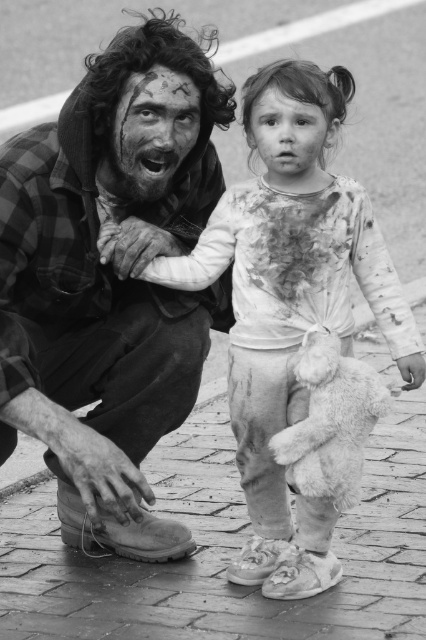
Question: From the image, what is the correct spatial relationship of dirty skin face at center in relation to dirty white face at center?

Choices:
 (A) above
 (B) below

Answer: (A)

Question: Is dirty plaid shirt at left further to camera compared to dirty skin face at center?

Choices:
 (A) yes
 (B) no

Answer: (B)

Question: Among these objects, which one is farthest from the camera?

Choices:
 (A) dirty white face at center
 (B) dirty plaid shirt at left
 (C) white cotton shirt at center
 (D) dirty skin face at center

Answer: (D)

Question: Among these points, which one is farthest from the camera?

Choices:
 (A) (x=264, y=282)
 (B) (x=189, y=106)
 (C) (x=255, y=113)

Answer: (B)

Question: Is the position of dirty skin face at center more distant than that of dirty white face at center?

Choices:
 (A) yes
 (B) no

Answer: (A)

Question: Which of these objects is positioned farthest from the dirty skin face at center?

Choices:
 (A) fluffy white teddy bear at lower center
 (B) dirty white face at center

Answer: (A)